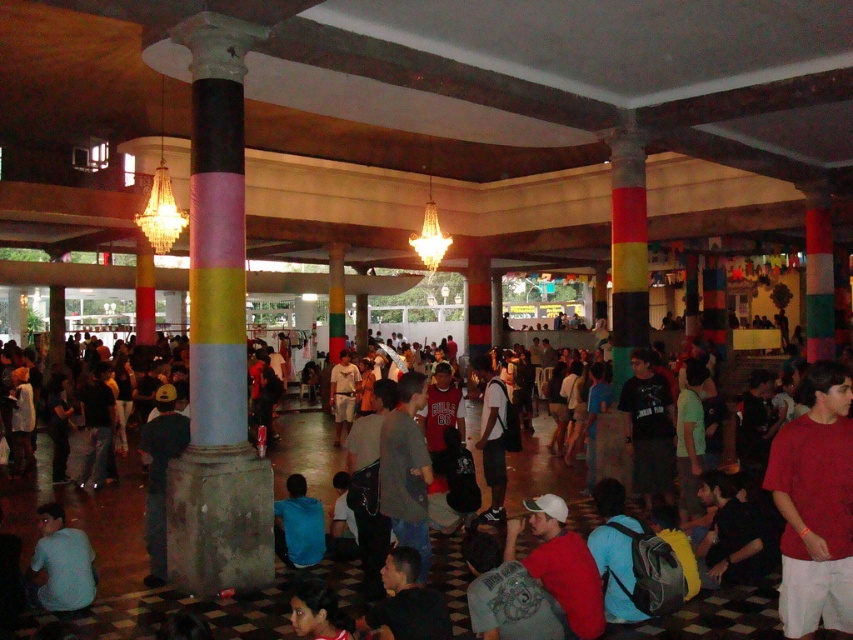
You are standing in the middle of the room and see a gray cotton shirt at center and a blue fabric shirt at lower center. Which shirt is positioned to the right of the other?

The gray cotton shirt at center is to the right of the blue fabric shirt at lower center.

You are standing in the middle of the room and want to take a photo of both point (x=802, y=588) and point (x=317, y=540). Which point should you focus on first to ensure both are in clear view?

You should focus on point (x=802, y=588) first because it is closer to the camera than point (x=317, y=540), ensuring both points are in focus.